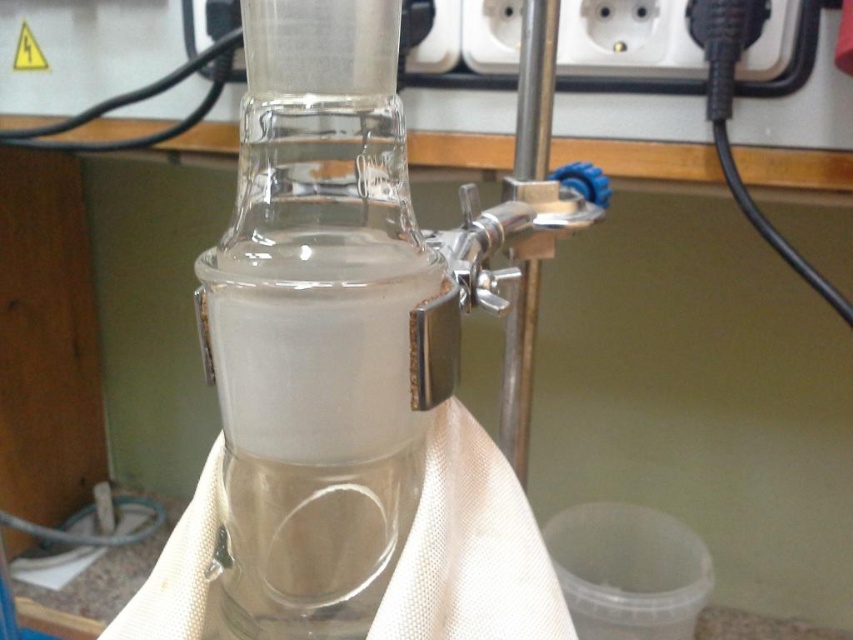
Can you confirm if transparent glass blender at center is shorter than white plastic socket at upper center?

No, transparent glass blender at center is not shorter than white plastic socket at upper center.

Who is more forward, (263, 116) or (456, 1)?

Point (263, 116) is in front.

Identify the location of transparent glass blender at center. (316, 324).

Which is above, white plastic socket at upper right or white plastic socket at upper center?

white plastic socket at upper center is above.

The height and width of the screenshot is (640, 853). I want to click on white plastic socket at upper right, so click(x=627, y=38).

Between point (618, 19) and point (212, 4), which one is positioned in front?

Point (618, 19) is in front.

This screenshot has height=640, width=853. What are the coordinates of `white plastic socket at upper right` in the screenshot? It's located at (627, 38).

Which is above, transparent glass blender at center or white plastic socket at upper right?

Positioned higher is white plastic socket at upper right.

Is transparent glass blender at center taller than white plastic socket at upper right?

Yes.

Between point (392, 29) and point (601, 17), which one is positioned behind?

The point (601, 17) is more distant.

Locate an element on the screen. transparent glass blender at center is located at coordinates (316, 324).